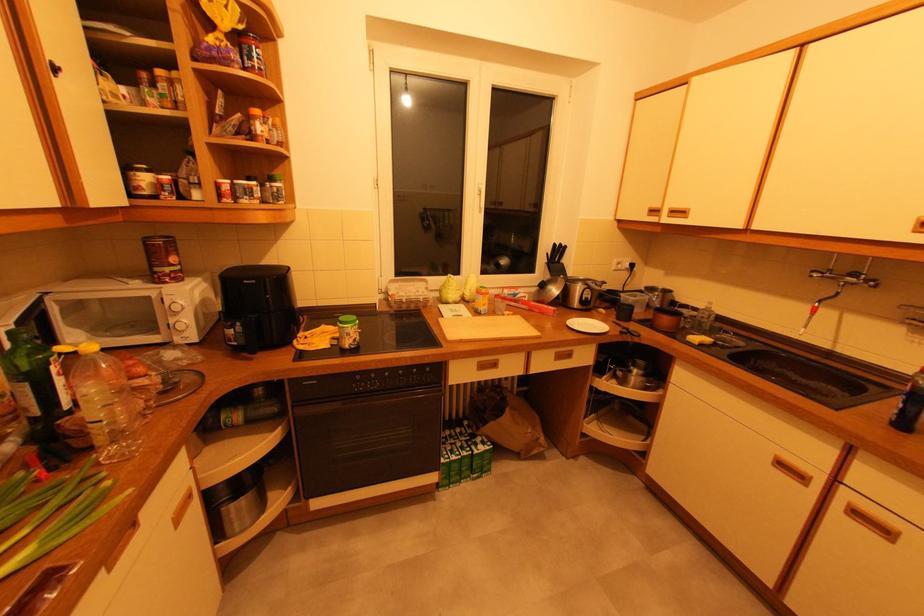
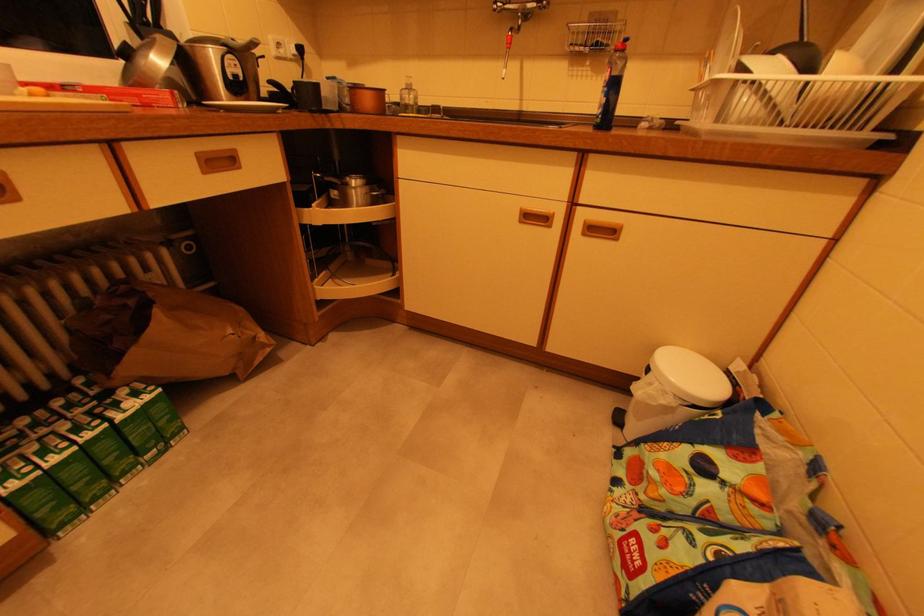
The point at (776, 466) is marked in the first image. Where is the corresponding point in the second image?

(523, 223)